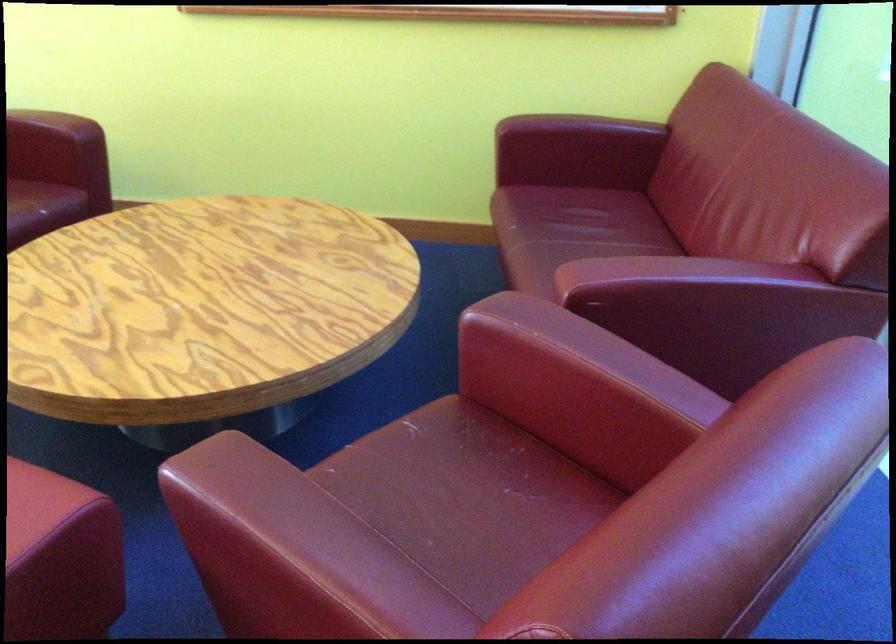
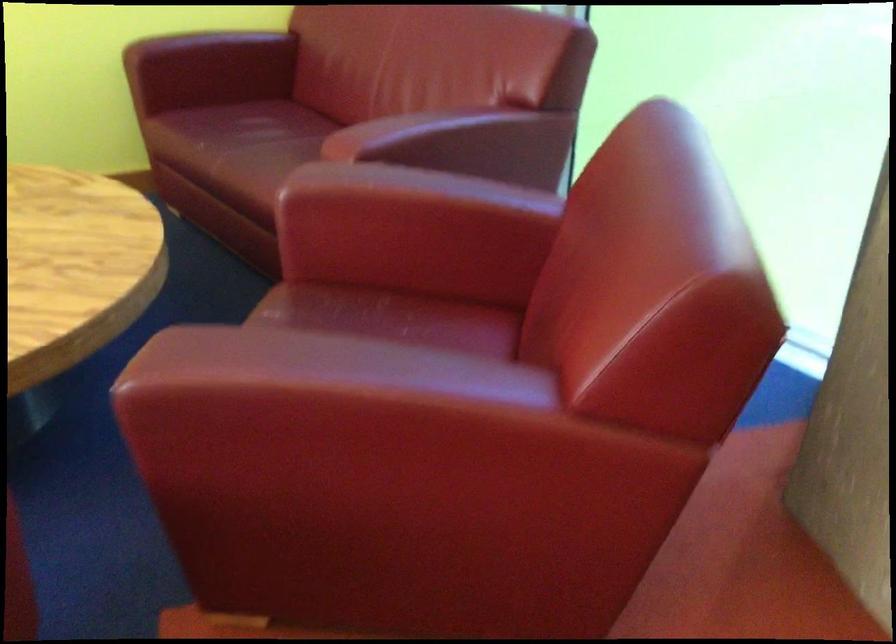
Question: The first image is from the beginning of the video and the second image is from the end. How did the camera likely rotate when shooting the video?

Choices:
 (A) Left
 (B) Right
 (C) Up
 (D) Down

Answer: (B)